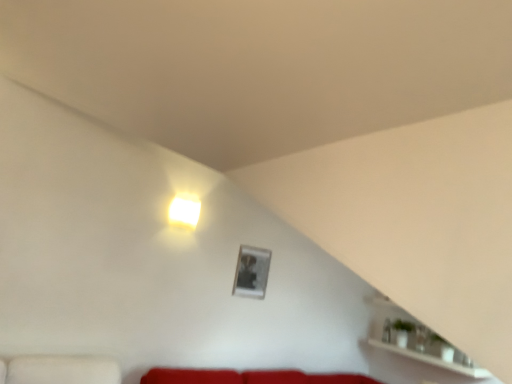
Question: Is white glossy cube at upper center looking in the opposite direction of white glossy shelf at lower right?

Choices:
 (A) no
 (B) yes

Answer: (A)

Question: From a real-world perspective, does white glossy cube at upper center sit lower than white glossy shelf at lower right?

Choices:
 (A) no
 (B) yes

Answer: (A)

Question: Is white glossy cube at upper center positioned behind white glossy shelf at lower right?

Choices:
 (A) yes
 (B) no

Answer: (A)

Question: Does white glossy cube at upper center have a lesser height compared to white glossy shelf at lower right?

Choices:
 (A) yes
 (B) no

Answer: (A)

Question: Can you confirm if white glossy cube at upper center is bigger than white glossy shelf at lower right?

Choices:
 (A) no
 (B) yes

Answer: (A)

Question: From the image's perspective, is white glossy shelf at lower right above or below white glossy cube at upper center?

Choices:
 (A) below
 (B) above

Answer: (A)

Question: Considering the positions of white glossy shelf at lower right and white glossy cube at upper center in the image, is white glossy shelf at lower right wider or thinner than white glossy cube at upper center?

Choices:
 (A) wide
 (B) thin

Answer: (A)

Question: Is white glossy shelf at lower right inside or outside of white glossy cube at upper center?

Choices:
 (A) inside
 (B) outside

Answer: (B)

Question: From their relative heights in the image, would you say white glossy shelf at lower right is taller or shorter than white glossy cube at upper center?

Choices:
 (A) tall
 (B) short

Answer: (A)

Question: From the image's perspective, is white glossy cube at upper center above or below white glossy shelf at lower right?

Choices:
 (A) below
 (B) above

Answer: (B)

Question: Looking at their shapes, would you say white glossy cube at upper center is wider or thinner than white glossy shelf at lower right?

Choices:
 (A) wide
 (B) thin

Answer: (B)

Question: Is point (178, 225) positioned closer to the camera than point (408, 327)?

Choices:
 (A) farther
 (B) closer

Answer: (B)

Question: From a real-world perspective, relative to white glossy shelf at lower right, is white glossy cube at upper center vertically above or below?

Choices:
 (A) below
 (B) above

Answer: (B)

Question: In terms of height, does metallic silver picture frame at upper center look taller or shorter compared to white glossy shelf at lower right?

Choices:
 (A) short
 (B) tall

Answer: (B)

Question: Would you say metallic silver picture frame at upper center is inside or outside white glossy shelf at lower right?

Choices:
 (A) inside
 (B) outside

Answer: (B)